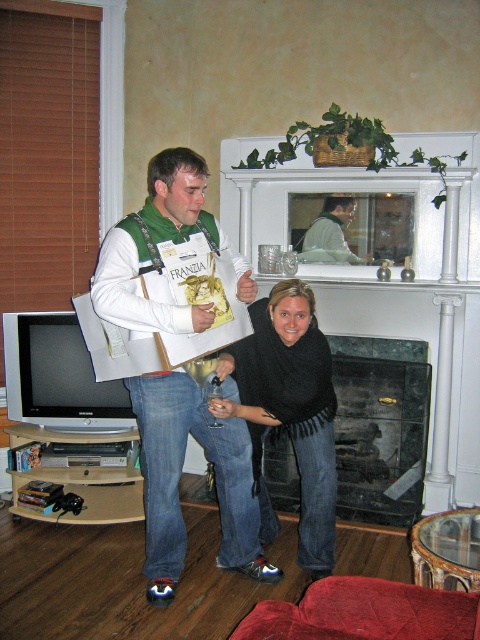
Question: Which of the following is the farthest from the observer?

Choices:
 (A) light gray sweater at upper center
 (B) black knitwear at center

Answer: (A)

Question: Does black marble fireplace at center appear on the right side of light gray sweater at upper center?

Choices:
 (A) no
 (B) yes

Answer: (B)

Question: Is black marble fireplace at center closer to the viewer compared to light gray sweater at upper center?

Choices:
 (A) yes
 (B) no

Answer: (A)

Question: Which object is closer to the camera taking this photo?

Choices:
 (A) green marble fireplace at upper center
 (B) light gray sweater at upper center

Answer: (A)

Question: Can you confirm if black marble fireplace at center is wider than light gray sweater at upper center?

Choices:
 (A) no
 (B) yes

Answer: (B)

Question: Which object is farther from the camera taking this photo?

Choices:
 (A) matte green vest at center
 (B) green marble fireplace at upper center
 (C) black knitwear at center

Answer: (B)